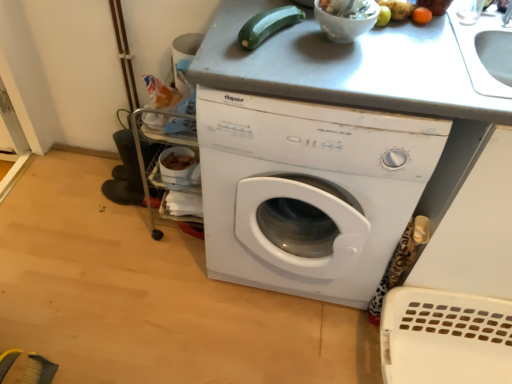
At what (x,y) coordinates should I click in order to perform the action: click on vacant space positioned to the left of white glossy bowl at upper center. Please return your answer as a coordinate pair (x, y). The image size is (512, 384). Looking at the image, I should click on (276, 39).